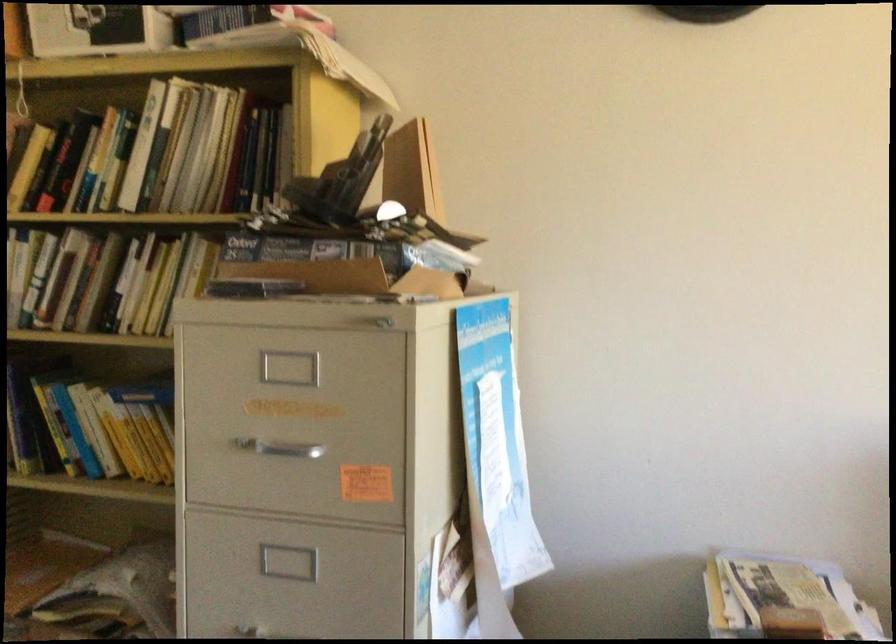
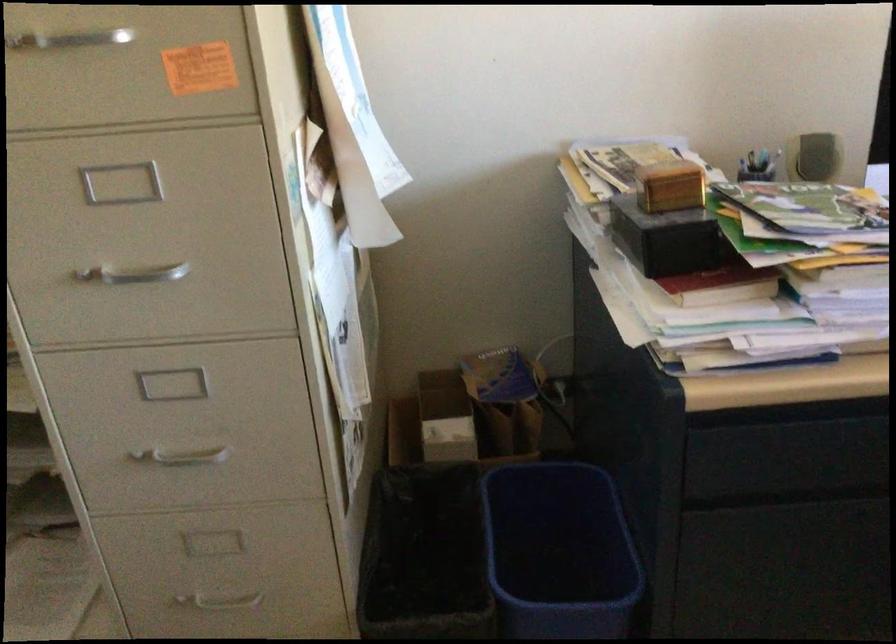
Question: How did the camera likely rotate?

Choices:
 (A) Left
 (B) Right
 (C) Up
 (D) Down

Answer: (D)